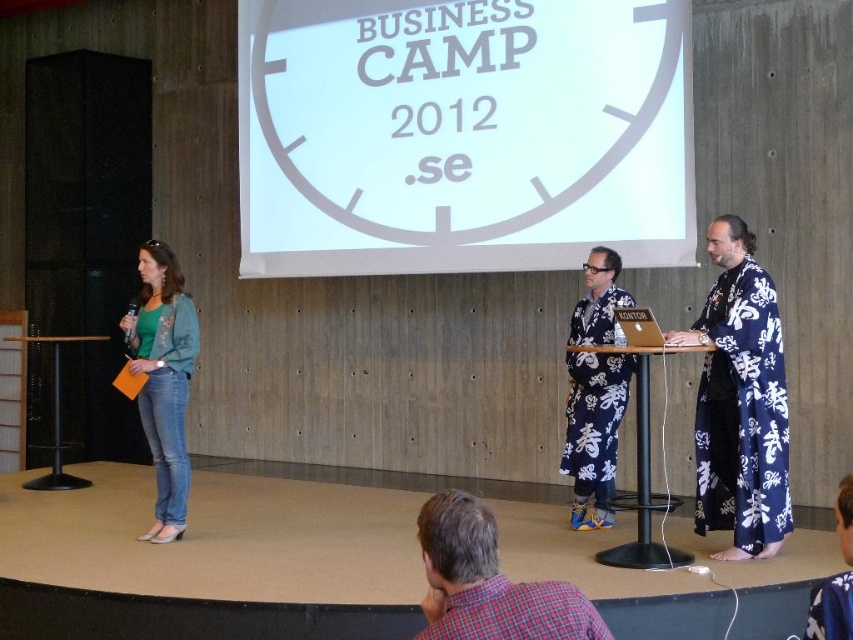
Question: Can you confirm if blue printed kimono at right is positioned below green textured robe at left?

Choices:
 (A) yes
 (B) no

Answer: (B)

Question: Which point is closer to the camera taking this photo?

Choices:
 (A) (428, 12)
 (B) (782, 468)
 (C) (480, 516)

Answer: (C)

Question: Does plaid shirt at lower center appear on the left side of green textured robe at left?

Choices:
 (A) no
 (B) yes

Answer: (A)

Question: Which point is farther to the camera?

Choices:
 (A) (474, 532)
 (B) (848, 570)

Answer: (B)

Question: Can you confirm if blue floral kimono at center is thinner than floral silk kimono at center?

Choices:
 (A) no
 (B) yes

Answer: (B)

Question: Which of the following is the closest to the observer?

Choices:
 (A) blue floral robe at center
 (B) blue floral kimono at center
 (C) plaid shirt at lower center

Answer: (C)